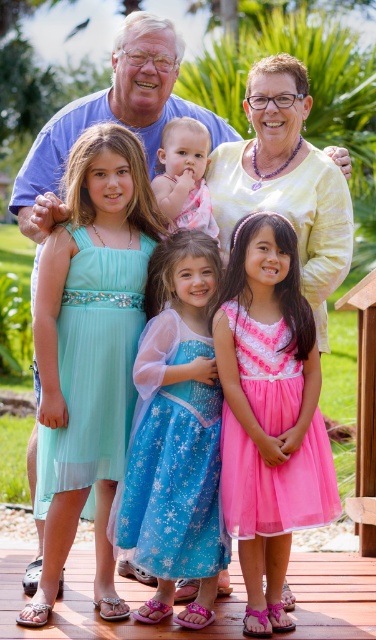
You are a photographer standing at the edge of the wooden deck. You want to take a photo of the pink tulle dress at lower center and the pink satin dress at center. Can you fit both subjects into your camera frame if your camera has a maximum horizontal field of view of 2 meters?

The distance between the pink tulle dress at lower center and the pink satin dress at center is 2.57 meters, which exceeds the camera frame of 2 meters. Therefore, both subjects cannot be captured in a single frame.

You are a photographer trying to adjust the lighting for the family portrait. You notice the blue satin dress at center and the pink tulle dress at lower center. Which dress requires more space between the subjects to avoid overlapping in the frame?

The pink tulle dress at lower center requires more space between the subjects because it has a larger size compared to the blue satin dress at center.

You are standing in the garden and want to place a small flower pot between the two points labeled point (228, 424) and point (177, 176). Which point should the flower pot be closer to in order to be nearer to the grandparents?

The flower pot should be closer to point (177, 176) because it is farther from the viewer compared to point (228, 424), which is closer to the grandparents.